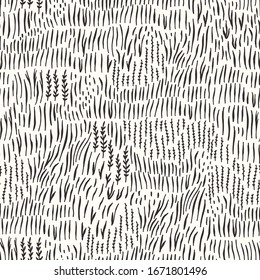
You are a GUI agent. You are given a task and a screenshot of the screen. Output one action in this format:
    pyautogui.click(x=<x>, y=<y>)
    Task: Click on the whimsical wall mural
    This screenshot has width=260, height=280.
    Given the screenshot: What is the action you would take?
    pyautogui.click(x=34, y=76), pyautogui.click(x=215, y=154), pyautogui.click(x=109, y=196)